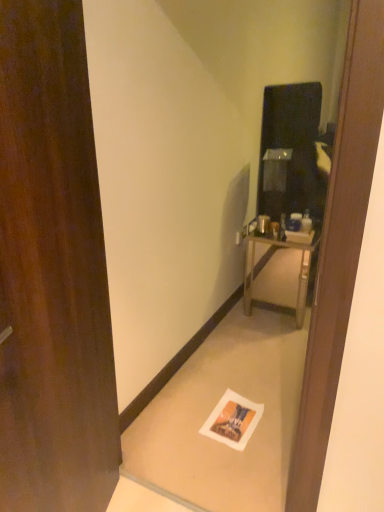
Question: Is brown wood door at left taller or shorter than metallic silver nightstand at right?

Choices:
 (A) tall
 (B) short

Answer: (A)

Question: Relative to metallic silver nightstand at right, is brown wood door at left in front or behind?

Choices:
 (A) behind
 (B) front

Answer: (B)

Question: Which object is the closest to the metallic silver nightstand at right?

Choices:
 (A) brown wood door at left
 (B) white paper at lower center

Answer: (B)

Question: Which object is the closest to the white paper at lower center?

Choices:
 (A) brown wood door at left
 (B) metallic silver nightstand at right

Answer: (A)